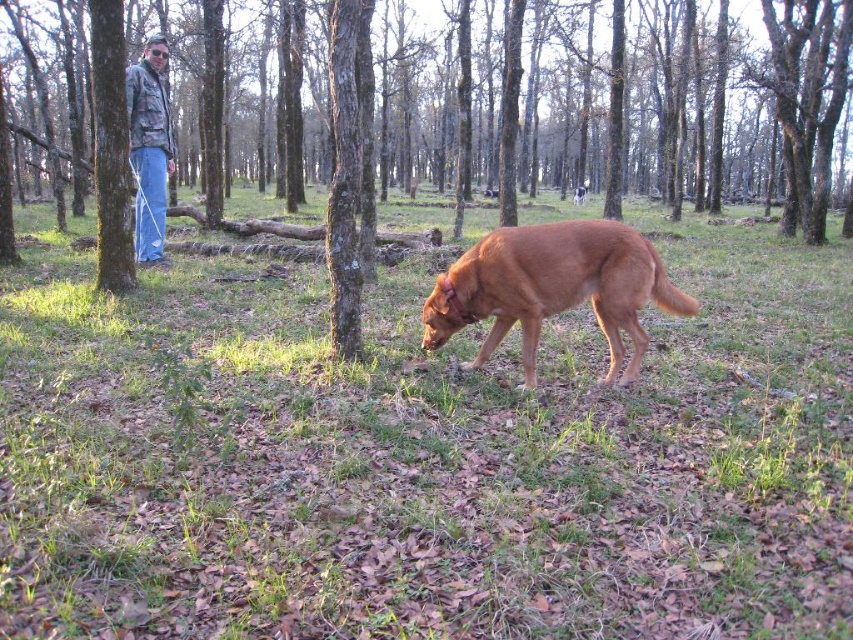
You are a hiker who wants to take a photo of the brown matte dog at center and the denim jacket at left. To ensure both are in focus, you need to know which object is taller. Can you tell me which one is taller?

The brown matte dog at center has a lesser height compared to denim jacket at left, so the denim jacket at left is taller. To ensure both are in focus, you should adjust the camera settings to account for the denim jacket at left being taller.

You are a hiker who has just arrived at this forest area. You see the green grass at center and the denim jacket at left. Which object is closer to you?

The denim jacket at left is closer to you because it is 6.28 meters away from the green grass at center, but since you are standing at the foreground where the dog is, the jacket is to the left and the grass is at the center, implying the jacket is nearer.

You are standing in a forest area and want to reach a specific point marked at coordinates point (593, 253). If you are currently 3 meters away from that point, how much farther do you need to walk to reach it?

The distance of point (593, 253) from viewer is 3.73 meters. Since you are already 3 meters away, you need to walk an additional 0.73 meters to reach the point.